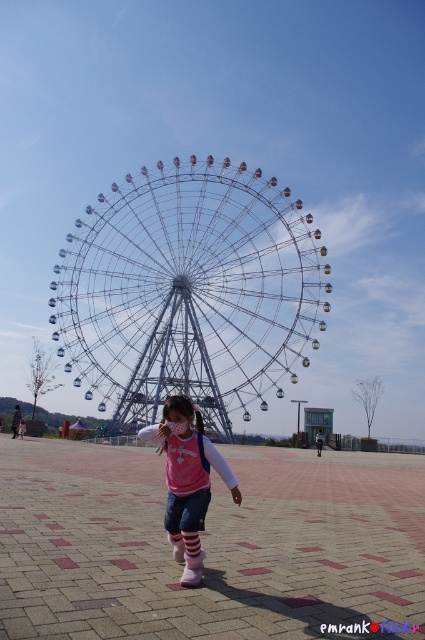
Question: Can you confirm if metallic wire ferris wheel at center is thinner than pink fabric shirt at center?

Choices:
 (A) no
 (B) yes

Answer: (A)

Question: Does metallic wire ferris wheel at center have a lesser width compared to white matte sock at center?

Choices:
 (A) yes
 (B) no

Answer: (B)

Question: From the image, what is the correct spatial relationship of pink fabric shirt at center in relation to white matte sock at center?

Choices:
 (A) right
 (B) left

Answer: (B)

Question: Estimate the real-world distances between objects in this image. Which object is farther from the pink fabric shirt at center?

Choices:
 (A) white matte sock at center
 (B) metallic wire ferris wheel at center

Answer: (B)

Question: Which of the following is the farthest from the observer?

Choices:
 (A) (195, 465)
 (B) (200, 387)
 (C) (186, 563)

Answer: (B)

Question: Which of the following is the farthest from the observer?

Choices:
 (A) (189, 563)
 (B) (200, 445)

Answer: (B)